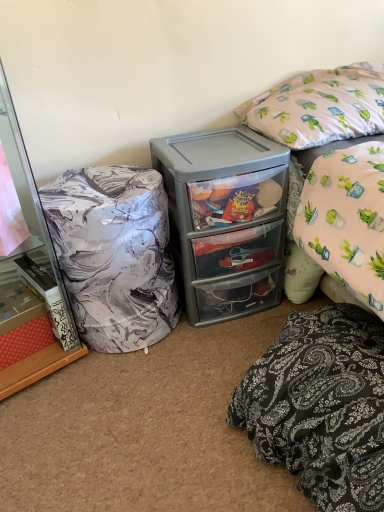
Describe the element at coordinates (30, 277) in the screenshot. The image size is (384, 512). I see `marble-patterned fabric at left` at that location.

Measure the distance between pink fabric pillow at upper right, the second pillow in the bottom-to-top sequence, and camera.

A distance of 1.37 meters exists between pink fabric pillow at upper right, the second pillow in the bottom-to-top sequence, and camera.

What are the coordinates of `pink fabric pillow at upper right, acting as the 1th pillow starting from the top` in the screenshot? It's located at (320, 106).

This screenshot has height=512, width=384. In order to click on marble-patterned bean bag at left in this screenshot , I will do coord(114,254).

Describe the element at coordinates (321, 406) in the screenshot. This screenshot has width=384, height=512. I see `black paisley pillow at lower right, which is the 1th pillow from bottom to top` at that location.

At what (x,y) coordinates should I click in order to perform the action: click on gray plastic storage at center. Please return your answer as a coordinate pair (x, y). The height and width of the screenshot is (512, 384). Looking at the image, I should click on (226, 219).

At what (x,y) coordinates should I click in order to perform the action: click on marble-patterned fabric at left. Please return your answer as a coordinate pair (x, y). The width and height of the screenshot is (384, 512). Looking at the image, I should click on (30, 277).

Consider the image. From a real-world perspective, is gray plastic storage at center on top of black paisley pillow at lower right, which is the 1th pillow from bottom to top?

Yes, from a real-world perspective, gray plastic storage at center is above black paisley pillow at lower right, which is the 1th pillow from bottom to top.

From the image's perspective, is gray plastic storage at center under black paisley pillow at lower right, the 2th pillow when ordered from top to bottom?

Actually, gray plastic storage at center appears above black paisley pillow at lower right, the 2th pillow when ordered from top to bottom, in the image.

Looking at this image, which object is positioned more to the left, gray plastic storage at center or black paisley pillow at lower right, the 2th pillow when ordered from top to bottom?

Positioned to the left is gray plastic storage at center.

Is gray plastic storage at center not close to black paisley pillow at lower right, the 2th pillow when ordered from top to bottom?

No, gray plastic storage at center is not far away from black paisley pillow at lower right, the 2th pillow when ordered from top to bottom.

Which object is positioned more to the right, marble-patterned bean bag at left or gray plastic storage at center?

gray plastic storage at center.

Are marble-patterned bean bag at left and gray plastic storage at center located far from each other?

That's not correct — marble-patterned bean bag at left is a little close to gray plastic storage at center.

Is gray plastic storage at center at the back of marble-patterned bean bag at left?

marble-patterned bean bag at left is not turned away from gray plastic storage at center.

Which of these two, marble-patterned bean bag at left or gray plastic storage at center, stands taller?

Standing taller between the two is gray plastic storage at center.

Is the depth of marble-patterned bean bag at left greater than that of marble-patterned fabric at left?

That is True.

Based on the photo, are marble-patterned bean bag at left and marble-patterned fabric at left far apart?

marble-patterned bean bag at left is actually quite close to marble-patterned fabric at left.

Considering the positions of points (74, 234) and (43, 334), is point (74, 234) closer to camera compared to point (43, 334)?

That is True.

Where is `bean bag chair that is under the marble-patterned fabric at left (from a real-world perspective)`? The width and height of the screenshot is (384, 512). bean bag chair that is under the marble-patterned fabric at left (from a real-world perspective) is located at coordinates (114, 254).

Does black paisley pillow at lower right, the 2th pillow when ordered from top to bottom, have a lesser height compared to marble-patterned fabric at left?

Yes, black paisley pillow at lower right, the 2th pillow when ordered from top to bottom, is shorter than marble-patterned fabric at left.

Is the surface of black paisley pillow at lower right, the 2th pillow when ordered from top to bottom, in direct contact with marble-patterned fabric at left?

No, black paisley pillow at lower right, the 2th pillow when ordered from top to bottom, is not next to marble-patterned fabric at left.

I want to click on cabinetry above the black paisley pillow at lower right, which is the 1th pillow from bottom to top (from a real-world perspective), so click(x=30, y=277).

Which of these two, black paisley pillow at lower right, which is the 1th pillow from bottom to top, or marble-patterned fabric at left, is thinner?

With smaller width is marble-patterned fabric at left.

Considering the relative sizes of marble-patterned bean bag at left and pink fabric pillow at upper right, the second pillow in the bottom-to-top sequence, in the image provided, is marble-patterned bean bag at left thinner than pink fabric pillow at upper right, the second pillow in the bottom-to-top sequence,?

Correct, the width of marble-patterned bean bag at left is less than that of pink fabric pillow at upper right, the second pillow in the bottom-to-top sequence.

Is marble-patterned bean bag at left inside the boundaries of pink fabric pillow at upper right, the second pillow in the bottom-to-top sequence, or outside?

The correct answer is: outside.

Is marble-patterned bean bag at left to the right of pink fabric pillow at upper right, acting as the 1th pillow starting from the top, from the viewer's perspective?

No.

Between marble-patterned bean bag at left and pink fabric pillow at upper right, the second pillow in the bottom-to-top sequence, which one has smaller size?

pink fabric pillow at upper right, the second pillow in the bottom-to-top sequence, is smaller.

Is black paisley pillow at lower right, the 2th pillow when ordered from top to bottom, wider than gray plastic storage at center?

Correct, the width of black paisley pillow at lower right, the 2th pillow when ordered from top to bottom, exceeds that of gray plastic storage at center.

In terms of height, does black paisley pillow at lower right, which is the 1th pillow from bottom to top, look taller or shorter compared to gray plastic storage at center?

Clearly, black paisley pillow at lower right, which is the 1th pillow from bottom to top, is shorter compared to gray plastic storage at center.

The width and height of the screenshot is (384, 512). I want to click on the 1st pillow to the right when counting from the gray plastic storage at center, so click(321, 406).

Is the position of black paisley pillow at lower right, the 2th pillow when ordered from top to bottom, more distant than that of gray plastic storage at center?

No, black paisley pillow at lower right, the 2th pillow when ordered from top to bottom, is closer to the camera.

Where is `bean bag chair on the right of marble-patterned fabric at left`? Image resolution: width=384 pixels, height=512 pixels. bean bag chair on the right of marble-patterned fabric at left is located at coordinates (x=114, y=254).

Is marble-patterned fabric at left to the left or to the right of marble-patterned bean bag at left in the image?

Clearly, marble-patterned fabric at left is on the left of marble-patterned bean bag at left in the image.

Is marble-patterned fabric at left aimed at marble-patterned bean bag at left?

No, marble-patterned fabric at left is not turned towards marble-patterned bean bag at left.

From a real-world perspective, is marble-patterned fabric at left positioned under marble-patterned bean bag at left based on gravity?

Incorrect, from a real-world perspective, marble-patterned fabric at left is higher than marble-patterned bean bag at left.

The height and width of the screenshot is (512, 384). I want to click on cooler on the left of black paisley pillow at lower right, which is the 1th pillow from bottom to top, so click(226, 219).

Where is `bean bag chair directly beneath the gray plastic storage at center (from a real-world perspective)`? This screenshot has width=384, height=512. bean bag chair directly beneath the gray plastic storage at center (from a real-world perspective) is located at coordinates tap(114, 254).

Which object lies nearer to the anchor point marble-patterned bean bag at left, black paisley pillow at lower right, the 2th pillow when ordered from top to bottom, or pink fabric pillow at upper right, the second pillow in the bottom-to-top sequence?

The object closer to marble-patterned bean bag at left is black paisley pillow at lower right, the 2th pillow when ordered from top to bottom.

Looking at the image, which one is located closer to marble-patterned fabric at left, pink fabric pillow at upper right, acting as the 1th pillow starting from the top, or black paisley pillow at lower right, which is the 1th pillow from bottom to top?

Among the two, black paisley pillow at lower right, which is the 1th pillow from bottom to top, is located nearer to marble-patterned fabric at left.

When comparing their distances from marble-patterned bean bag at left, does marble-patterned fabric at left or black paisley pillow at lower right, which is the 1th pillow from bottom to top, seem closer?

marble-patterned fabric at left.

Considering their positions, is black paisley pillow at lower right, the 2th pillow when ordered from top to bottom, positioned further to marble-patterned fabric at left than gray plastic storage at center?

Among the two, black paisley pillow at lower right, the 2th pillow when ordered from top to bottom, is located further to marble-patterned fabric at left.

Estimate the real-world distances between objects in this image. Which object is closer to gray plastic storage at center, marble-patterned fabric at left or pink fabric pillow at upper right, acting as the 1th pillow starting from the top?

pink fabric pillow at upper right, acting as the 1th pillow starting from the top, is closer to gray plastic storage at center.

Estimate the real-world distances between objects in this image. Which object is further from marble-patterned bean bag at left, pink fabric pillow at upper right, the second pillow in the bottom-to-top sequence, or marble-patterned fabric at left?

pink fabric pillow at upper right, the second pillow in the bottom-to-top sequence, lies further to marble-patterned bean bag at left than the other object.

Which object lies further to the anchor point pink fabric pillow at upper right, acting as the 1th pillow starting from the top, marble-patterned fabric at left or gray plastic storage at center?

Based on the image, marble-patterned fabric at left appears to be further to pink fabric pillow at upper right, acting as the 1th pillow starting from the top.

Based on their spatial positions, is pink fabric pillow at upper right, acting as the 1th pillow starting from the top, or gray plastic storage at center closer to black paisley pillow at lower right, which is the 1th pillow from bottom to top?

→ gray plastic storage at center is positioned closer to the anchor black paisley pillow at lower right, which is the 1th pillow from bottom to top.

At what (x,y) coordinates should I click in order to perform the action: click on cooler between marble-patterned bean bag at left and black paisley pillow at lower right, which is the 1th pillow from bottom to top, in the horizontal direction. Please return your answer as a coordinate pair (x, y). Looking at the image, I should click on (226, 219).

Locate an element on the screen. cooler between pink fabric pillow at upper right, acting as the 1th pillow starting from the top, and black paisley pillow at lower right, which is the 1th pillow from bottom to top, from top to bottom is located at coordinates (226, 219).

Identify the location of cooler situated between marble-patterned bean bag at left and pink fabric pillow at upper right, the second pillow in the bottom-to-top sequence, from left to right. The image size is (384, 512). (226, 219).

The width and height of the screenshot is (384, 512). In order to click on bean bag chair located between marble-patterned fabric at left and pink fabric pillow at upper right, acting as the 1th pillow starting from the top, in the left-right direction in this screenshot , I will do `click(114, 254)`.